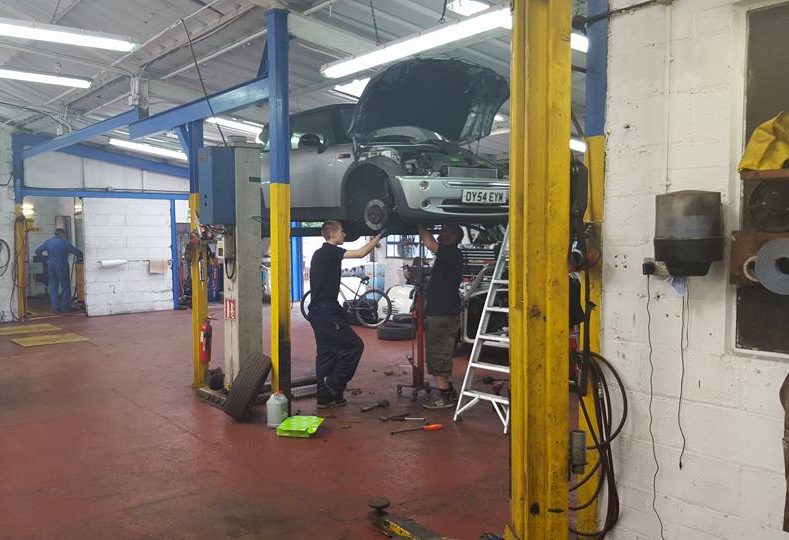
Locate an element on the screen. fire extinguisher is located at coordinates (204, 339).